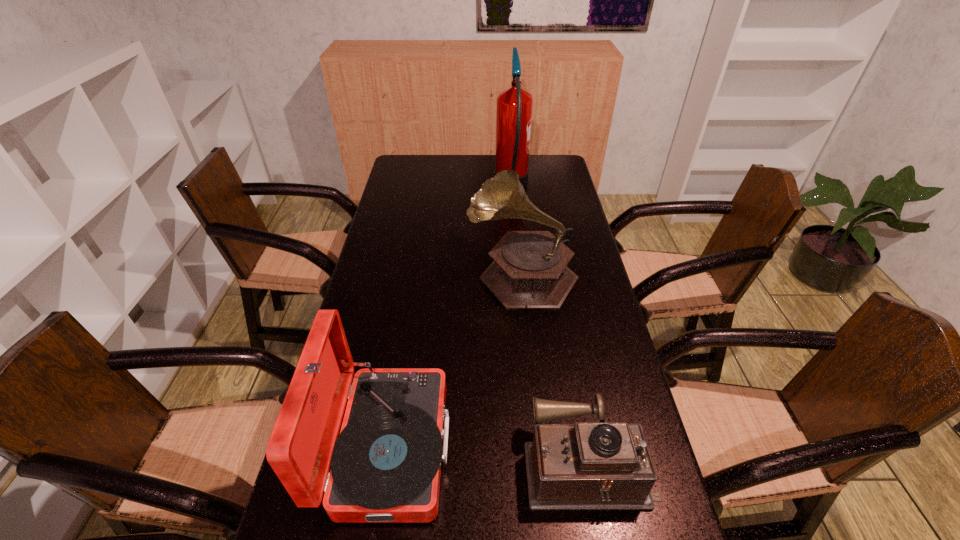
Where is `empty location between the leftmost phonograph_record and the shortest object`? The height and width of the screenshot is (540, 960). empty location between the leftmost phonograph_record and the shortest object is located at coordinates (489, 455).

This screenshot has height=540, width=960. What are the coordinates of `unoccupied position between the second farthest object and the leftmost object` in the screenshot? It's located at (455, 360).

The height and width of the screenshot is (540, 960). Find the location of `vacant space that is in between the farthest phonograph_record and the leftmost phonograph_record`. vacant space that is in between the farthest phonograph_record and the leftmost phonograph_record is located at coordinates (455, 360).

The height and width of the screenshot is (540, 960). In order to click on free space between the tallest object and the leftmost phonograph_record in this screenshot , I will do `click(450, 316)`.

The height and width of the screenshot is (540, 960). I want to click on free space between the tallest object and the leftmost phonograph_record, so click(450, 316).

You are a GUI agent. You are given a task and a screenshot of the screen. Output one action in this format:
    pyautogui.click(x=<x>, y=<y>)
    Task: Click on the free area in between the farthest object and the leftmost object
    
    Given the screenshot: What is the action you would take?
    coord(450,316)

Identify the location of vacant space that is in between the leftmost phonograph_record and the fire extinguisher. (450, 316).

The height and width of the screenshot is (540, 960). I want to click on free space between the shortest object and the second farthest object, so click(x=555, y=368).

Locate an element on the screen. This screenshot has height=540, width=960. empty space that is in between the farthest phonograph_record and the shortest phonograph_record is located at coordinates (555, 368).

The width and height of the screenshot is (960, 540). I want to click on object that can be found as the third closest to the tallest object, so click(600, 465).